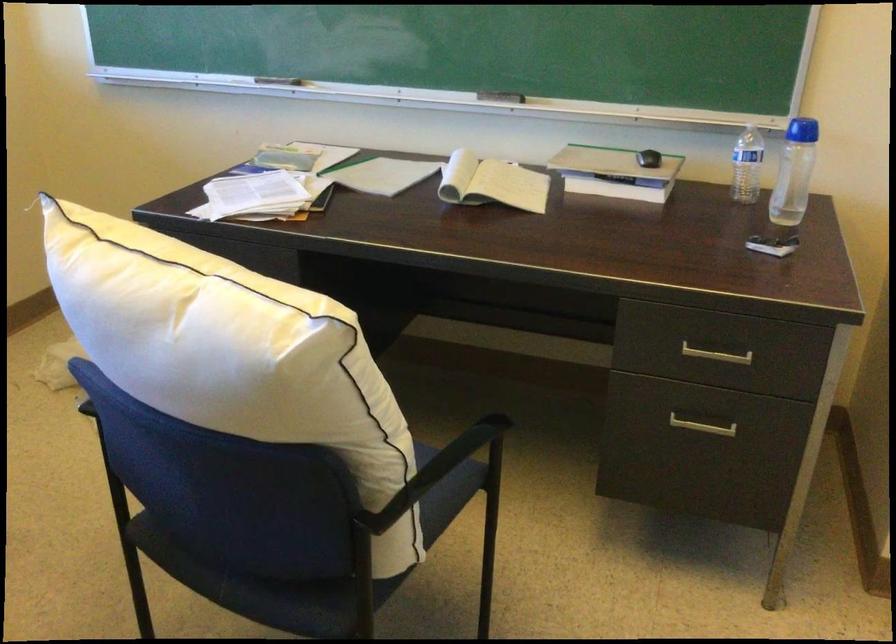
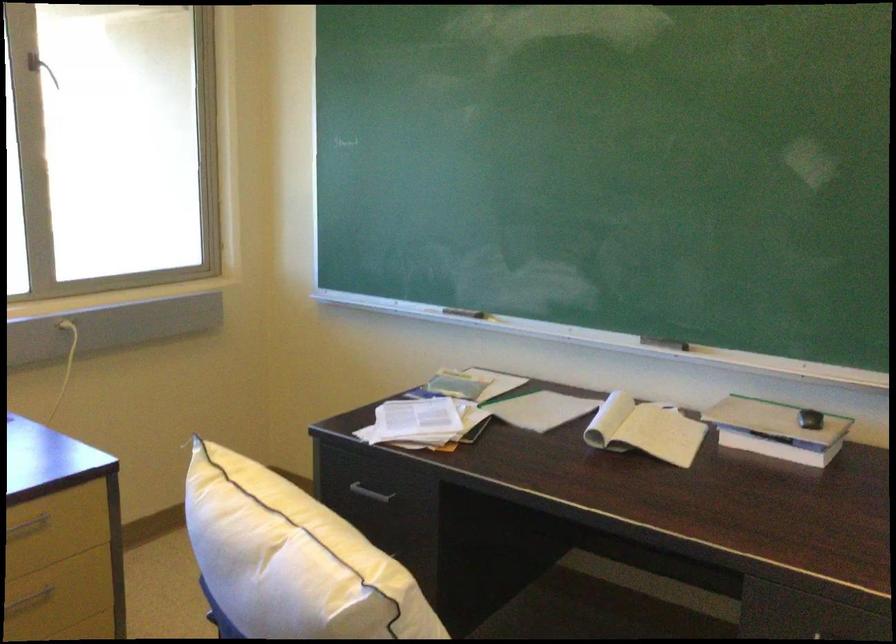
Locate, in the second image, the point that corresponds to (x=619, y=176) in the first image.

(776, 430)